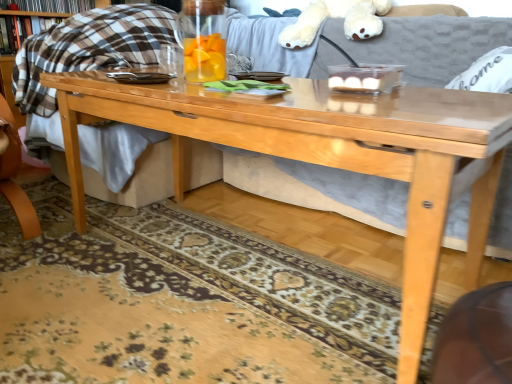
Question: Is plaid fabric book at upper left, the second book from the top, beside transparent glass pitcher at center?

Choices:
 (A) no
 (B) yes

Answer: (A)

Question: Does plaid fabric book at upper left, the second book from the top, have a lesser width compared to transparent glass pitcher at center?

Choices:
 (A) yes
 (B) no

Answer: (A)

Question: From a real-world perspective, is plaid fabric book at upper left, the second book from the top, on top of transparent glass pitcher at center?

Choices:
 (A) yes
 (B) no

Answer: (B)

Question: Does plaid fabric book at upper left, marked as the 1th book in a bottom-to-top arrangement, have a larger size compared to transparent glass pitcher at center?

Choices:
 (A) no
 (B) yes

Answer: (B)

Question: Is plaid fabric book at upper left, the second book from the top, oriented towards transparent glass pitcher at center?

Choices:
 (A) yes
 (B) no

Answer: (A)

Question: Visually, is hardcover book at upper left, which ranks as the 2th book in bottom-to-top order, positioned to the left or to the right of transparent glass pitcher at center?

Choices:
 (A) left
 (B) right

Answer: (A)

Question: Is hardcover book at upper left, marked as the first book in a top-to-bottom arrangement, taller or shorter than transparent glass pitcher at center?

Choices:
 (A) short
 (B) tall

Answer: (A)

Question: In terms of width, does hardcover book at upper left, marked as the first book in a top-to-bottom arrangement, look wider or thinner when compared to transparent glass pitcher at center?

Choices:
 (A) thin
 (B) wide

Answer: (A)

Question: Is point (31, 1) closer or farther from the camera than point (202, 56)?

Choices:
 (A) farther
 (B) closer

Answer: (A)

Question: Does point (84, 1) appear closer or farther from the camera than point (473, 86)?

Choices:
 (A) closer
 (B) farther

Answer: (B)

Question: From a real-world perspective, is hardcover book at upper left, marked as the first book in a top-to-bottom arrangement, physically located above or below white fabric pillow at upper right?

Choices:
 (A) above
 (B) below

Answer: (A)

Question: Considering the relative positions of hardcover book at upper left, which ranks as the 2th book in bottom-to-top order, and white fabric pillow at upper right in the image provided, is hardcover book at upper left, which ranks as the 2th book in bottom-to-top order, to the left or to the right of white fabric pillow at upper right?

Choices:
 (A) right
 (B) left

Answer: (B)

Question: In terms of height, does hardcover book at upper left, which ranks as the 2th book in bottom-to-top order, look taller or shorter compared to white fabric pillow at upper right?

Choices:
 (A) short
 (B) tall

Answer: (A)

Question: From the image's perspective, is transparent glass pitcher at center located above or below white plush bear at upper center?

Choices:
 (A) below
 (B) above

Answer: (A)

Question: From a real-world perspective, is transparent glass pitcher at center positioned above or below white plush bear at upper center?

Choices:
 (A) above
 (B) below

Answer: (B)